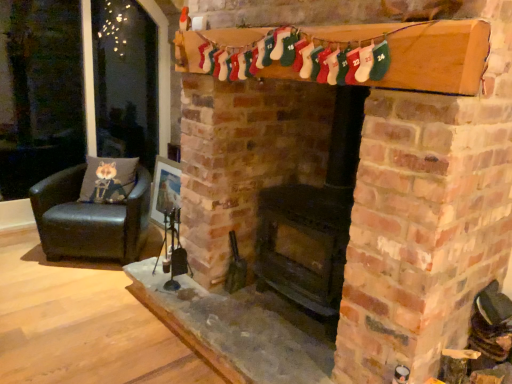
The image size is (512, 384). I want to click on vacant space that is to the left of black matte fireplace at center, so click(x=225, y=320).